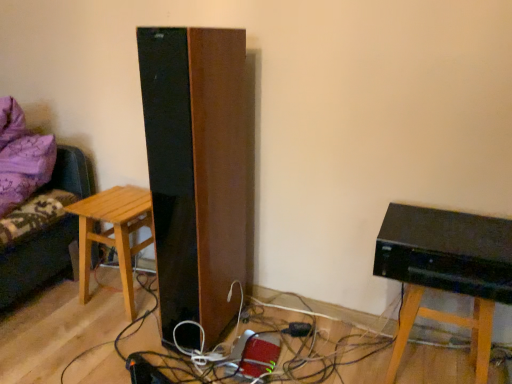
Identify the location of free spot in front of light brown wooden stool at left. This screenshot has height=384, width=512. (101, 335).